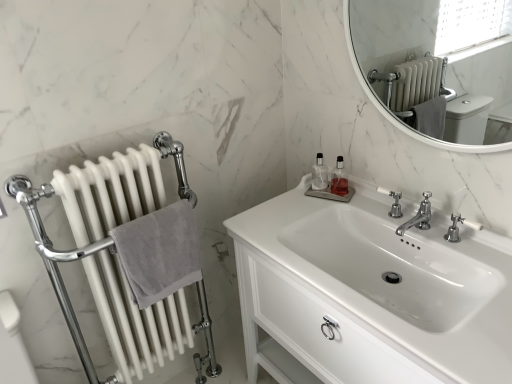
Locate an element on the screen. vacant point to the right of clear glass bottle at upper center, the first toiletry when ordered from right to left is located at coordinates (368, 198).